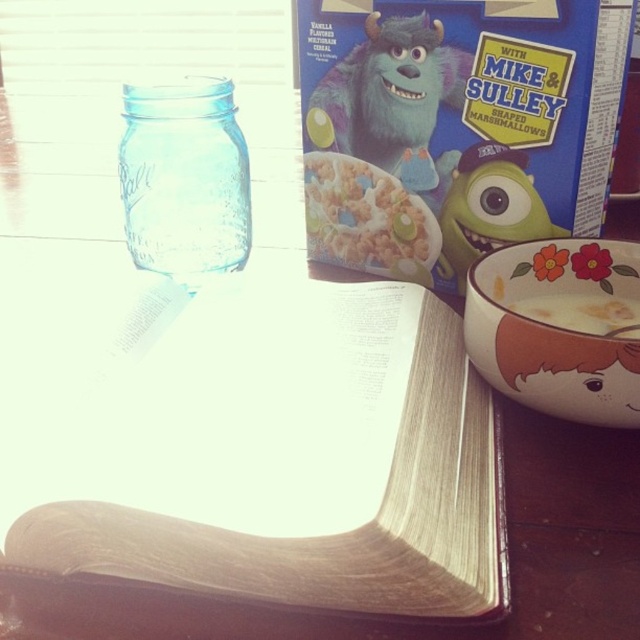
Does light brown paper book at center appear over white creamy cereal at lower right?

No.

Does light brown paper book at center have a lesser width compared to white creamy cereal at lower right?

No.

Is point (317, 596) farther from viewer compared to point (580, 317)?

No.

This screenshot has width=640, height=640. Identify the location of light brown paper book at center. (250, 444).

Is light brown paper book at center further to the viewer compared to porcelain floral bowl at lower right?

No.

Which is more to the left, light brown paper book at center or porcelain floral bowl at lower right?

light brown paper book at center

Image resolution: width=640 pixels, height=640 pixels. Find the location of `light brown paper book at center`. light brown paper book at center is located at coordinates (250, 444).

Between transparent glass jar at upper left and white creamy cereal at lower right, which one is positioned lower?

Positioned lower is white creamy cereal at lower right.

Which is in front, point (152, 140) or point (589, 320)?

Point (589, 320)

The image size is (640, 640). Find the location of `transparent glass jar at upper left`. transparent glass jar at upper left is located at coordinates (184, 177).